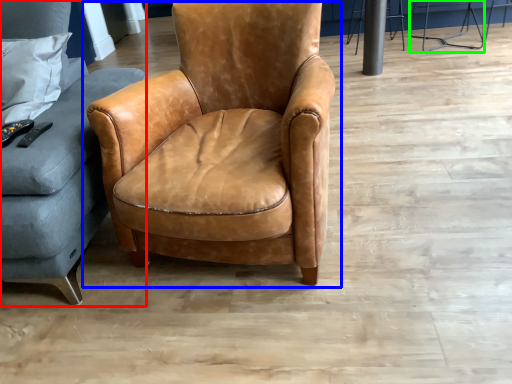
Question: Which object is positioned farthest from studio couch (highlighted by a red box)? Select from chair (highlighted by a blue box) and bar stool (highlighted by a green box).

Choices:
 (A) chair
 (B) bar stool

Answer: (B)